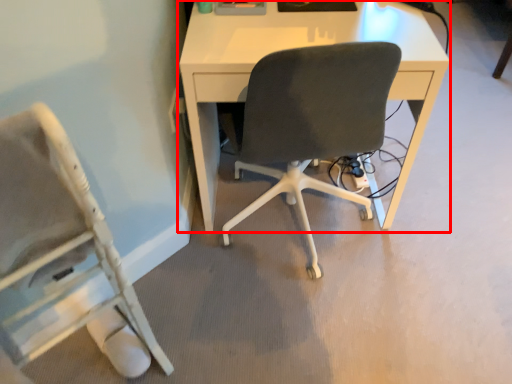
Question: Where is desk (annotated by the red box) located in relation to chair in the image?

Choices:
 (A) left
 (B) right

Answer: (B)